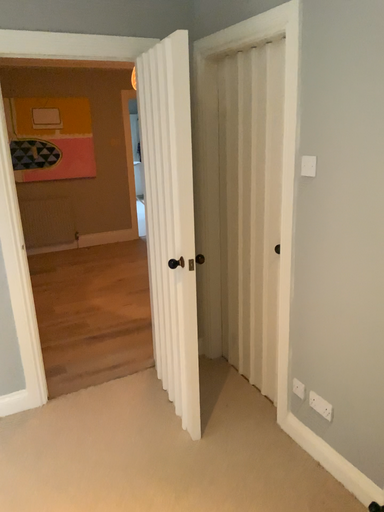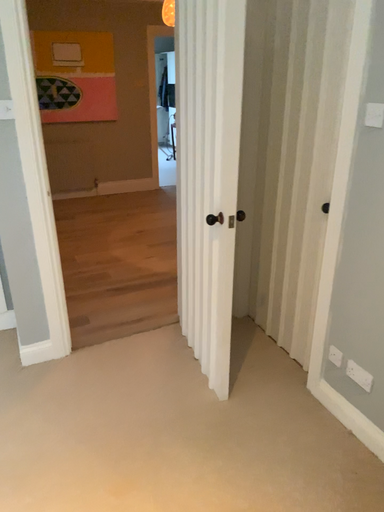
Question: How did the camera likely rotate when shooting the video?

Choices:
 (A) rotated upward
 (B) rotated downward

Answer: (B)